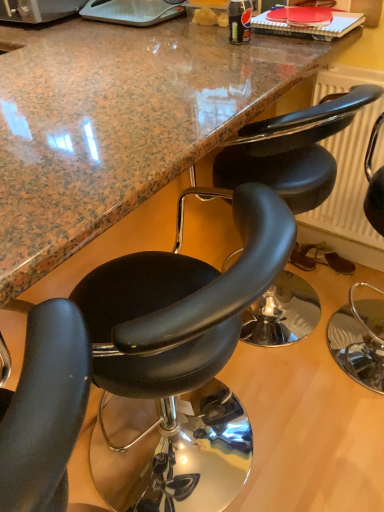
Question: Looking at the image, does black leather chair at center, the 2th chair in the right-to-left sequence, seem bigger or smaller compared to marble countertop at center?

Choices:
 (A) big
 (B) small

Answer: (B)

Question: From the image's perspective, is black leather chair at center, the 2th chair viewed from the left, above or below marble countertop at center?

Choices:
 (A) above
 (B) below

Answer: (B)

Question: Which object is the closest to the black leather chair at right, which is the 1th chair in right-to-left order?

Choices:
 (A) marble countertop at center
 (B) black leather chair at center, the 2th chair viewed from the left
 (C) black leather chair at center, arranged as the 1th chair when viewed from the left

Answer: (B)

Question: Which object is the farthest from the black leather chair at center, the 2th chair in the right-to-left sequence?

Choices:
 (A) black leather chair at center, the 3th chair viewed from the right
 (B) marble countertop at center
 (C) black leather chair at right, which is the 1th chair in right-to-left order

Answer: (C)